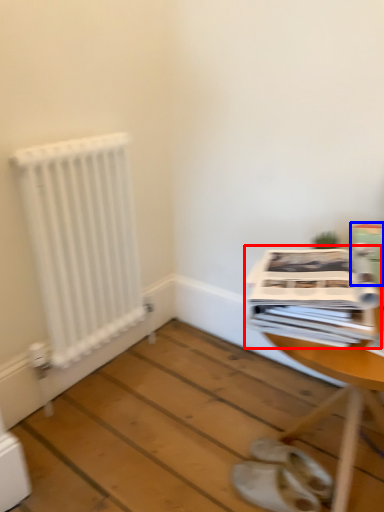
Question: Which object appears closest to the camera in this image, magazine (highlighted by a red box) or cardboard box (highlighted by a blue box)?

Choices:
 (A) magazine
 (B) cardboard box

Answer: (A)